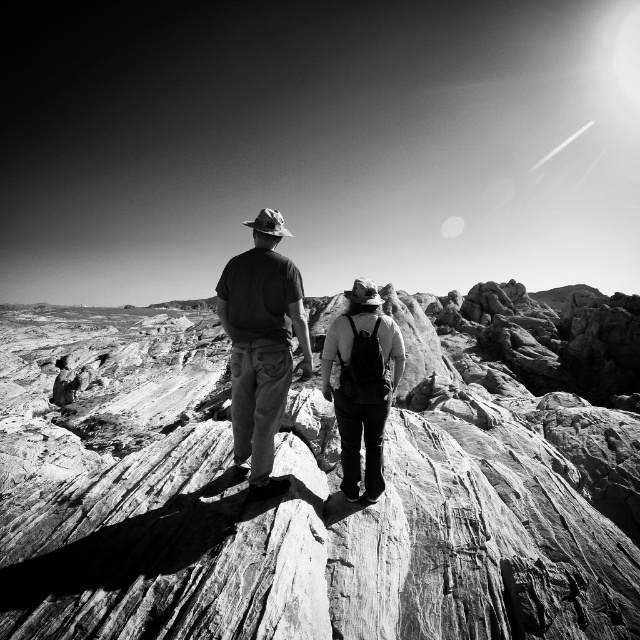
You are a photographer trying to capture both the dark gray cotton shirt at center and the matte black backpack at center in a single frame. Based on their sizes, which object should you focus on first to ensure both are in the frame?

The dark gray cotton shirt at center is larger in size than the matte black backpack at center, so you should focus on the dark gray cotton shirt at center first to ensure both fit within the frame.

Consider the image. You are a hiker who needs to place a 2 meter long tent between the rugged stone rock at center and the matte black backpack at center. Can you fit the tent in the space between them?

The distance between the rugged stone rock at center and the matte black backpack at center is 34.97 meters. Since the tent is only 2 meters long, there is more than enough space to place it between them.